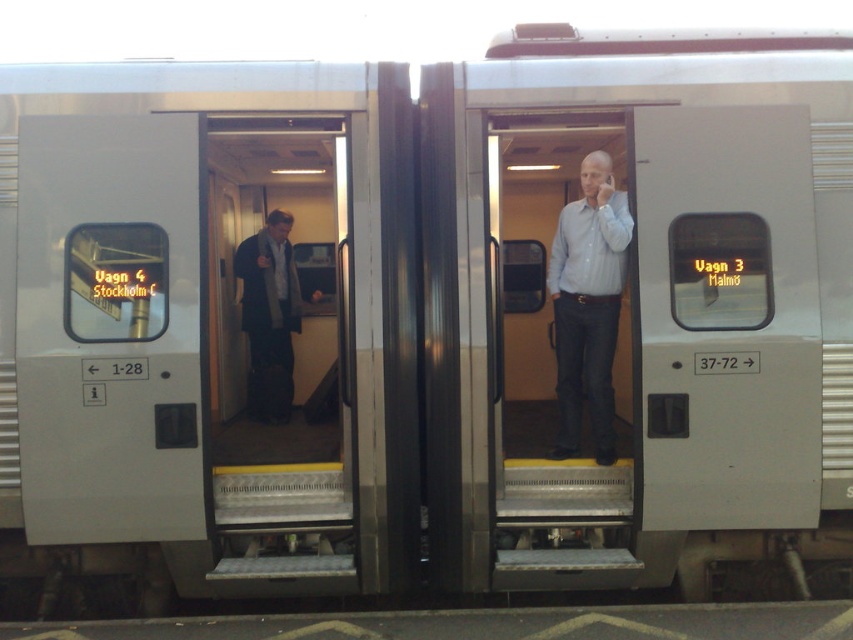
Question: Among these objects, which one is nearest to the camera?

Choices:
 (A) dark gray suit at left
 (B) metallic gray door at center
 (C) metallic silver door at center
 (D) light blue shirt at center

Answer: (C)

Question: Which object is positioned closest to the metallic silver door at center?

Choices:
 (A) metallic gray door at center
 (B) dark gray suit at left
 (C) light blue shirt at center

Answer: (C)

Question: Does metallic gray door at center come behind light blue shirt at center?

Choices:
 (A) yes
 (B) no

Answer: (A)

Question: Can you confirm if metallic gray door at center is thinner than light blue shirt at center?

Choices:
 (A) no
 (B) yes

Answer: (A)

Question: Does metallic gray door at center have a smaller size compared to metallic silver door at center?

Choices:
 (A) yes
 (B) no

Answer: (A)

Question: Which of the following is the farthest from the observer?

Choices:
 (A) metallic silver door at center
 (B) light blue shirt at center
 (C) metallic gray door at center

Answer: (C)